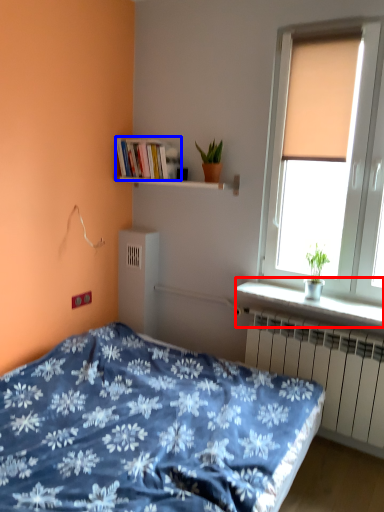
Question: Among these objects, which one is farthest to the camera, window sill (highlighted by a red box) or book (highlighted by a blue box)?

Choices:
 (A) window sill
 (B) book

Answer: (B)